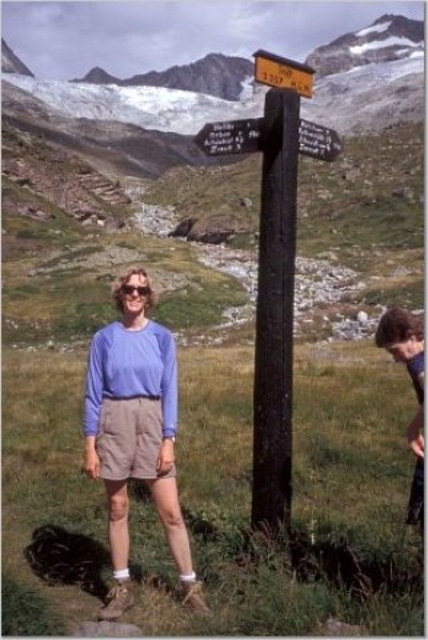
Question: Does brown leather jacket at lower right appear under yellow wooden signpost at center?

Choices:
 (A) yes
 (B) no

Answer: (A)

Question: Which object is positioned closest to the matte blue shirt at center?

Choices:
 (A) brown leather jacket at lower right
 (B) wooden post at center
 (C) yellow wooden signpost at center

Answer: (A)

Question: Which object appears farthest from the camera in this image?

Choices:
 (A) wooden post at center
 (B) yellow wooden signpost at center
 (C) brown leather jacket at lower right
 (D) matte blue shirt at center

Answer: (C)

Question: Does wooden post at center appear under yellow wooden signpost at center?

Choices:
 (A) yes
 (B) no

Answer: (A)

Question: Is wooden post at center positioned in front of yellow wooden signpost at center?

Choices:
 (A) yes
 (B) no

Answer: (A)

Question: Among these objects, which one is nearest to the camera?

Choices:
 (A) yellow wooden signpost at center
 (B) wooden post at center
 (C) brown leather jacket at lower right
 (D) dark brown wood post at center

Answer: (B)